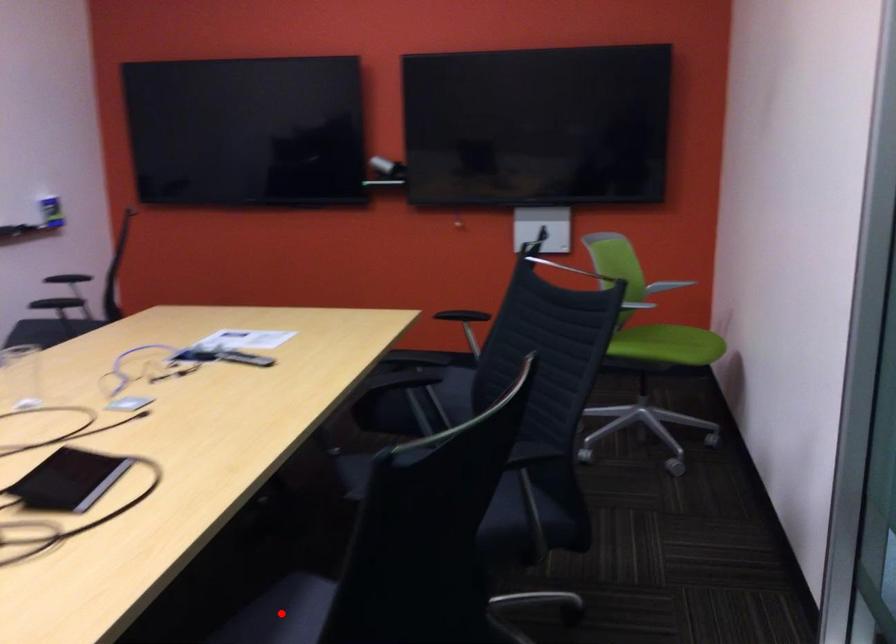
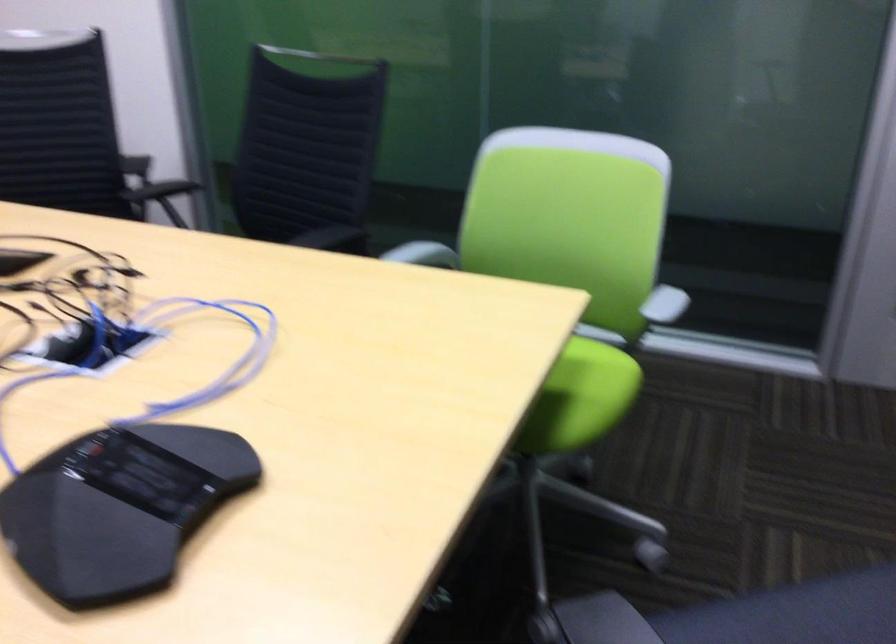
Question: I am providing you with two images of the same scene from different viewpoints. A red point is marked on the first image. Is the red point's position out of view in image 2?

Choices:
 (A) Yes
 (B) No

Answer: (A)